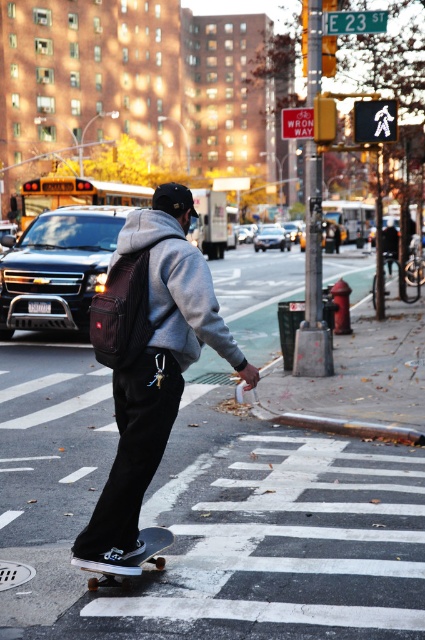
Question: Is matte black backpack at center further to camera compared to black matte skateboard at lower center?

Choices:
 (A) yes
 (B) no

Answer: (B)

Question: Which point is farther to the camera?

Choices:
 (A) (200, 307)
 (B) (138, 557)

Answer: (B)

Question: Is matte black backpack at center positioned behind gray fleece sweatshirt at center?

Choices:
 (A) no
 (B) yes

Answer: (B)

Question: Which point is closer to the camera taking this photo?

Choices:
 (A) (243, 355)
 (B) (169, 321)
 (C) (107, 579)

Answer: (B)

Question: Does gray fleece sweatshirt at center appear over black matte skateboard at lower center?

Choices:
 (A) no
 (B) yes

Answer: (B)

Question: Which point is farther from the camera taking this photo?

Choices:
 (A) (203, 336)
 (B) (163, 532)

Answer: (B)